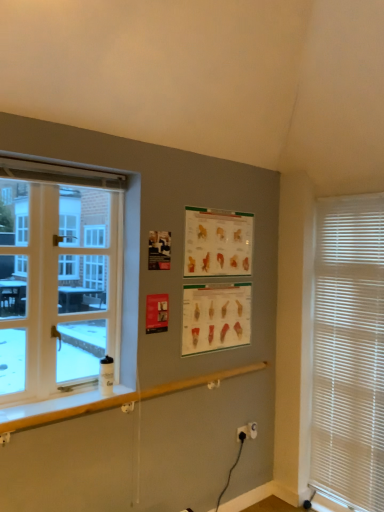
Question: In the image, is white wood window sill at lower left positioned in front of or behind matte paper poster at center, which is the 2th poster page in top-to-bottom order?

Choices:
 (A) behind
 (B) front

Answer: (B)

Question: From a real-world perspective, is white wood window sill at lower left above or below matte paper poster at center, which is the 1th poster page from bottom to top?

Choices:
 (A) below
 (B) above

Answer: (A)

Question: Estimate the real-world distances between objects in this image. Which object is farther from the black plastic electric outlet at lower center, which is the 1th electric outlet from left to right?

Choices:
 (A) matte paper poster at center, which is the 1th poster page from bottom to top
 (B) black plastic electric outlet at lower right, acting as the second electric outlet starting from the left
 (C) white glass window at left
 (D) white wood window sill at lower left
 (E) white plastic electric outlet at lower center, acting as the 3th electric outlet starting from the left

Answer: (C)

Question: Which of these objects is positioned farthest from the matte paper poster at upper center, which is the second poster page in bottom-to-top order?

Choices:
 (A) white textured blinds at right
 (B) black plastic electric outlet at lower center, the 3th electric outlet viewed from the right
 (C) white wood window sill at lower left
 (D) white plastic electric outlet at lower center, acting as the 3th electric outlet starting from the left
 (E) black plastic electric outlet at lower right, the second electric outlet from the right

Answer: (D)